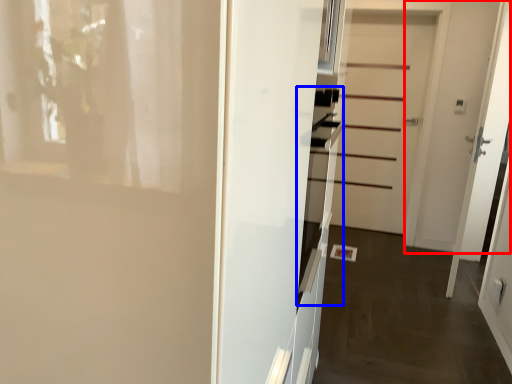
Question: Among these objects, which one is farthest to the camera, door (highlighted by a red box) or oven (highlighted by a blue box)?

Choices:
 (A) door
 (B) oven

Answer: (A)